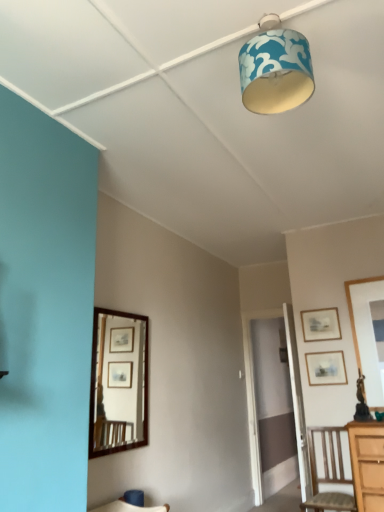
Measure the distance between matte wooden picture frame at right, positioned as the 2th picture frame in top-to-bottom order, and camera.

matte wooden picture frame at right, positioned as the 2th picture frame in top-to-bottom order, is 11.77 feet from camera.

Describe the element at coordinates (326, 368) in the screenshot. The image size is (384, 512). I see `matte wooden picture frame at right, positioned as the 2th picture frame in top-to-bottom order` at that location.

Locate an element on the screen. blue fabric lampshade at upper center is located at coordinates (275, 69).

The image size is (384, 512). Describe the element at coordinates (275, 69) in the screenshot. I see `blue fabric lampshade at upper center` at that location.

Image resolution: width=384 pixels, height=512 pixels. Describe the element at coordinates (321, 324) in the screenshot. I see `wooden picture frame at upper right, the second picture frame ordered from the bottom` at that location.

The width and height of the screenshot is (384, 512). I want to click on matte wooden picture frame at right, positioned as the 2th picture frame in top-to-bottom order, so click(326, 368).

From a real-world perspective, is wooden chair at lower right positioned over wooden picture frame at upper right, positioned as the first picture frame in top-to-bottom order, based on gravity?

No.

Between point (352, 506) and point (314, 328), which one is positioned behind?

The point (314, 328) is behind.

Is wooden chair at lower right further to the viewer compared to wooden picture frame at upper right, the second picture frame ordered from the bottom?

No.

Is wooden chair at lower right bigger than wooden picture frame at upper right, positioned as the first picture frame in top-to-bottom order?

Indeed, wooden chair at lower right has a larger size compared to wooden picture frame at upper right, positioned as the first picture frame in top-to-bottom order.

Consider the image. Is brown wooden mirror at left to the left or to the right of wooden picture frame at upper right, the second picture frame ordered from the bottom, in the image?

brown wooden mirror at left is positioned on wooden picture frame at upper right, the second picture frame ordered from the bottom,'s left side.

Does point (147, 398) lie in front of point (308, 312)?

Yes.

Which is correct: brown wooden mirror at left is inside wooden picture frame at upper right, positioned as the first picture frame in top-to-bottom order, or outside of it?

brown wooden mirror at left is spatially situated outside wooden picture frame at upper right, positioned as the first picture frame in top-to-bottom order.

Consider the image. Is brown wooden mirror at left next to matte wooden picture frame at right, the 1th picture frame ordered from the bottom?

No, brown wooden mirror at left is not in contact with matte wooden picture frame at right, the 1th picture frame ordered from the bottom.

Is brown wooden mirror at left outside of matte wooden picture frame at right, the 1th picture frame ordered from the bottom?

Absolutely, brown wooden mirror at left is external to matte wooden picture frame at right, the 1th picture frame ordered from the bottom.

Can you confirm if brown wooden mirror at left is shorter than matte wooden picture frame at right, positioned as the 2th picture frame in top-to-bottom order?

In fact, brown wooden mirror at left may be taller than matte wooden picture frame at right, positioned as the 2th picture frame in top-to-bottom order.

Considering the sizes of objects brown wooden mirror at left and matte wooden picture frame at right, the 1th picture frame ordered from the bottom, in the image provided, who is wider, brown wooden mirror at left or matte wooden picture frame at right, the 1th picture frame ordered from the bottom,?

brown wooden mirror at left is wider.

Considering the sizes of objects matte wooden picture frame at right, positioned as the 2th picture frame in top-to-bottom order, and wooden chair at lower right in the image provided, who is thinner, matte wooden picture frame at right, positioned as the 2th picture frame in top-to-bottom order, or wooden chair at lower right?

matte wooden picture frame at right, positioned as the 2th picture frame in top-to-bottom order.

Considering the sizes of matte wooden picture frame at right, the 1th picture frame ordered from the bottom, and wooden chair at lower right in the image, is matte wooden picture frame at right, the 1th picture frame ordered from the bottom, taller or shorter than wooden chair at lower right?

In the image, matte wooden picture frame at right, the 1th picture frame ordered from the bottom, appears to be shorter than wooden chair at lower right.

From the wooden chair at lower right, count 1st picture frames backward and point to it. Please provide its 2D coordinates.

[(326, 368)]

Is matte wooden picture frame at right, positioned as the 2th picture frame in top-to-bottom order, completely or partially outside of wooden chair at lower right?

Yes, matte wooden picture frame at right, positioned as the 2th picture frame in top-to-bottom order, is located beyond the bounds of wooden chair at lower right.

Is point (141, 433) positioned behind point (313, 509)?

No, it is not.

From a real-world perspective, which object stands above the other?

brown wooden mirror at left, from a real-world perspective.

Is brown wooden mirror at left located outside wooden chair at lower right?

Yes, brown wooden mirror at left is not within wooden chair at lower right.

Where is `chair located on the right of brown wooden mirror at left`? The height and width of the screenshot is (512, 384). chair located on the right of brown wooden mirror at left is located at coordinates (328, 474).

Between brown wooden mirror at left and blue fabric lampshade at upper center, which one is positioned behind?

brown wooden mirror at left is behind.

Is brown wooden mirror at left smaller than blue fabric lampshade at upper center?

Actually, brown wooden mirror at left might be larger than blue fabric lampshade at upper center.

Could you tell me if brown wooden mirror at left is turned towards blue fabric lampshade at upper center?

No, brown wooden mirror at left does not turn towards blue fabric lampshade at upper center.

Is point (131, 335) closer to camera compared to point (277, 54)?

No, it is behind (277, 54).

From the image's perspective, who appears lower, wooden chair at lower right or matte wooden picture frame at right, positioned as the 2th picture frame in top-to-bottom order?

wooden chair at lower right.

Is wooden chair at lower right outside of matte wooden picture frame at right, the 1th picture frame ordered from the bottom?

Indeed, wooden chair at lower right is completely outside matte wooden picture frame at right, the 1th picture frame ordered from the bottom.

Is point (339, 472) closer or farther from the camera than point (311, 375)?

Point (339, 472) is positioned closer to the camera compared to point (311, 375).

Who is bigger, wooden chair at lower right or matte wooden picture frame at right, positioned as the 2th picture frame in top-to-bottom order?

wooden chair at lower right.

You are a GUI agent. You are given a task and a screenshot of the screen. Output one action in this format:
    pyautogui.click(x=<x>, y=<y>)
    Task: Click on the chair below the wooden picture frame at upper right, the second picture frame ordered from the bottom (from a real-world perspective)
    The image size is (384, 512).
    Given the screenshot: What is the action you would take?
    pyautogui.click(x=328, y=474)

In order to click on mirror on the left of the wooden picture frame at upper right, positioned as the first picture frame in top-to-bottom order in this screenshot , I will do `click(118, 382)`.

From the image, which object appears to be farther from wooden chair at lower right, blue fabric lampshade at upper center or matte wooden picture frame at right, positioned as the 2th picture frame in top-to-bottom order?

The object further to wooden chair at lower right is blue fabric lampshade at upper center.

Based on the photo, from the image, which object appears to be farther from brown wooden mirror at left, wooden picture frame at upper right, positioned as the first picture frame in top-to-bottom order, or wooden chair at lower right?

wooden picture frame at upper right, positioned as the first picture frame in top-to-bottom order, is further to brown wooden mirror at left.

In the scene shown: From the image, which object appears to be nearer to wooden chair at lower right, wooden picture frame at upper right, positioned as the first picture frame in top-to-bottom order, or matte wooden picture frame at right, positioned as the 2th picture frame in top-to-bottom order?

matte wooden picture frame at right, positioned as the 2th picture frame in top-to-bottom order, is positioned closer to the anchor wooden chair at lower right.

From the picture: Based on their spatial positions, is matte wooden picture frame at right, the 1th picture frame ordered from the bottom, or brown wooden mirror at left further from wooden picture frame at upper right, the second picture frame ordered from the bottom?

Based on the image, brown wooden mirror at left appears to be further to wooden picture frame at upper right, the second picture frame ordered from the bottom.

From the image, which object appears to be farther from brown wooden mirror at left, wooden picture frame at upper right, the second picture frame ordered from the bottom, or blue fabric lampshade at upper center?

Among the two, blue fabric lampshade at upper center is located further to brown wooden mirror at left.

Looking at the image, which one is located closer to matte wooden picture frame at right, positioned as the 2th picture frame in top-to-bottom order, wooden picture frame at upper right, positioned as the first picture frame in top-to-bottom order, or wooden chair at lower right?

wooden picture frame at upper right, positioned as the first picture frame in top-to-bottom order, is positioned closer to the anchor matte wooden picture frame at right, positioned as the 2th picture frame in top-to-bottom order.

When comparing their distances from wooden picture frame at upper right, the second picture frame ordered from the bottom, does wooden chair at lower right or matte wooden picture frame at right, positioned as the 2th picture frame in top-to-bottom order, seem further?

The object further to wooden picture frame at upper right, the second picture frame ordered from the bottom, is wooden chair at lower right.

Which object lies further to the anchor point blue fabric lampshade at upper center, matte wooden picture frame at right, the 1th picture frame ordered from the bottom, or wooden chair at lower right?

wooden chair at lower right is positioned further to the anchor blue fabric lampshade at upper center.

Locate an element on the screen. mirror between blue fabric lampshade at upper center and wooden chair at lower right vertically is located at coordinates (118, 382).

Find the location of a particular element. This screenshot has height=512, width=384. picture frame between blue fabric lampshade at upper center and wooden picture frame at upper right, the second picture frame ordered from the bottom, along the z-axis is located at coordinates (326, 368).

You are a GUI agent. You are given a task and a screenshot of the screen. Output one action in this format:
    pyautogui.click(x=<x>, y=<y>)
    Task: Click on the mirror positioned between blue fabric lampshade at upper center and matte wooden picture frame at right, the 1th picture frame ordered from the bottom, from near to far
    
    Given the screenshot: What is the action you would take?
    pyautogui.click(x=118, y=382)

Find the location of a particular element. This screenshot has width=384, height=512. picture frame between wooden picture frame at upper right, positioned as the first picture frame in top-to-bottom order, and wooden chair at lower right in the up-down direction is located at coordinates (326, 368).